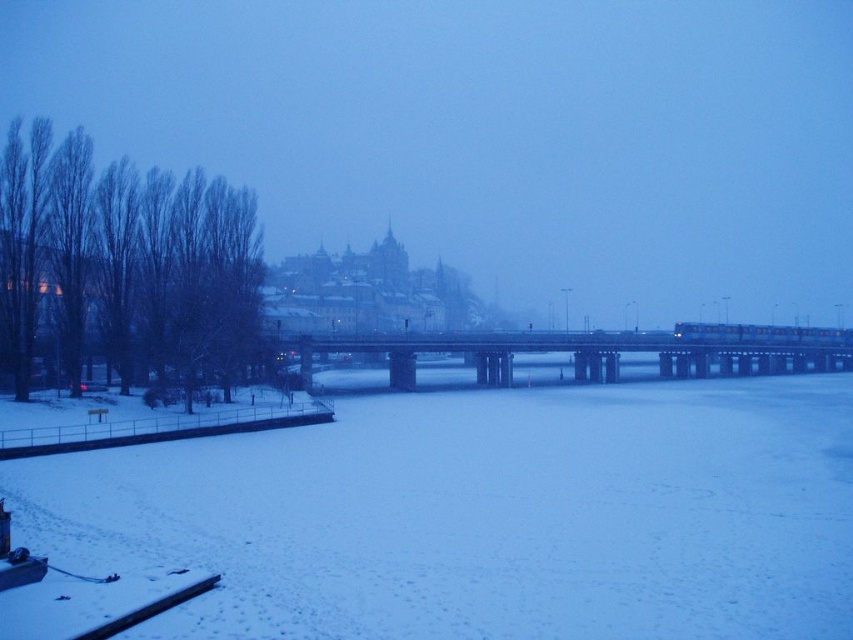
You are a photographer planning to capture the entire bridge and the snow in the scene. Given that your camera frame can only accommodate objects up to the width of the concrete bridge at center, will the white powdery snow at center fit within the frame?

The white powdery snow at center has a width less than the concrete bridge at center, so it will fit within the camera frame designed for the bridge width.

You are standing at the wooden walkway on the left side of the snow covered riverbank and want to reach the bridge. There are two points marked on the image, point A at coordinates point (337,461) and point B at coordinates point (436,348). Which point should you head towards to get closer to the bridge first?

Point A at coordinates point (337,461) is closer to the viewer than point B at coordinates point (436,348), so you should head towards point A to get closer to the bridge first.

You are a delivery person trying to cross the frozen river. You see the white powdery snow at center and the concrete bridge at center. Which surface should you walk on to safely cross the river?

You should walk on the concrete bridge at center because the white powdery snow at center is positioned under it, meaning the snow might be part of the river surface which is frozen but potentially unsafe. The bridge provides a solid structure for crossing safely.